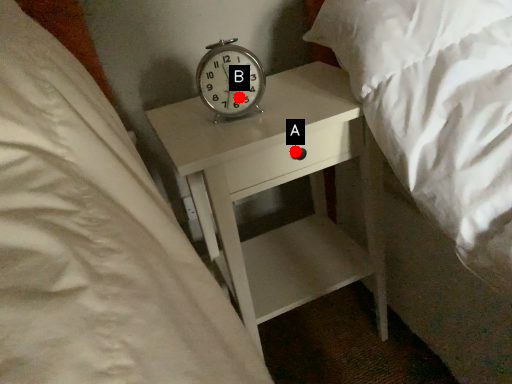
Question: Two points are circled on the image, labeled by A and B beside each circle. Which point is farther from the camera taking this photo?

Choices:
 (A) A is further
 (B) B is further

Answer: (B)